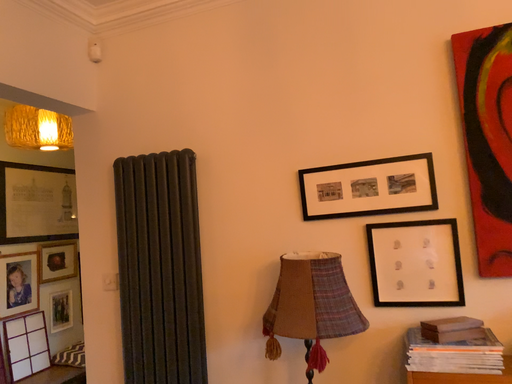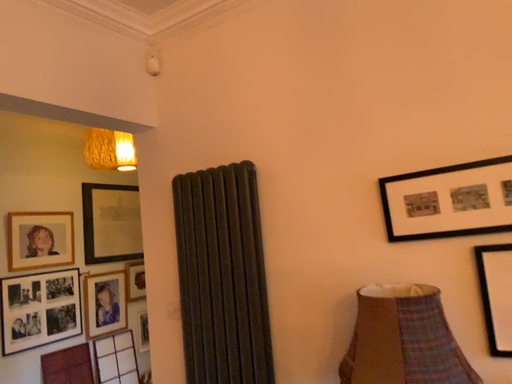
Question: Which way did the camera rotate in the video?

Choices:
 (A) rotated right
 (B) rotated left

Answer: (B)